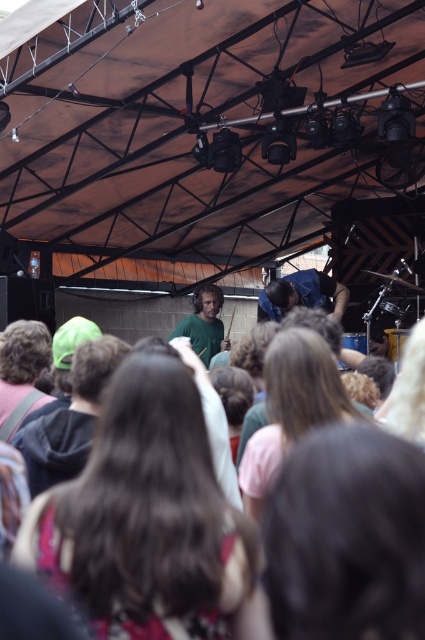
Question: Which object is closer to the camera taking this photo?

Choices:
 (A) brown hair at center
 (B) blue fabric shirt at center

Answer: (A)

Question: Is brown hair at center further to the viewer compared to blue fabric shirt at center?

Choices:
 (A) yes
 (B) no

Answer: (B)

Question: Considering the relative positions of brown hair at center and blue fabric shirt at center in the image provided, where is brown hair at center located with respect to blue fabric shirt at center?

Choices:
 (A) right
 (B) left

Answer: (B)

Question: Among these points, which one is farthest from the camera?

Choices:
 (A) (316, 298)
 (B) (413, 515)

Answer: (A)

Question: Can you confirm if brown hair at center is positioned to the right of blue fabric shirt at center?

Choices:
 (A) yes
 (B) no

Answer: (B)